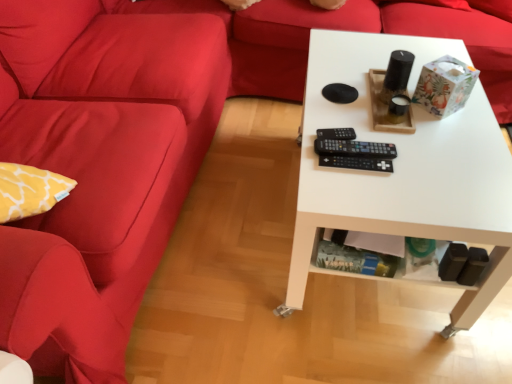
What are the coordinates of `vacant area that lies between black plastic remote at center, the 1th control when ordered from bottom to top, and black plastic remote at center, acting as the 1th control starting from the top` in the screenshot? It's located at (351, 145).